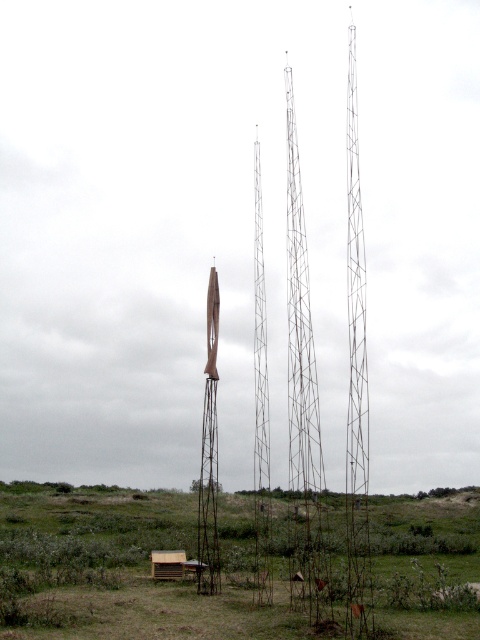
You are a photographer planning to take a photo of the metallic grid tower at center and the shiny metallic rocket at center. Since you want both objects to be clearly visible in your photo, which one should you focus on first to ensure sharpness?

You should focus on the metallic grid tower at center first because it is closer to the viewer than the shiny metallic rocket at center, so focusing on it will ensure both are in focus if they are within the same depth of field.

You are an engineer inspecting the site and need to determine the spatial relationship between the metallic grid tower at center and the shiny metallic rocket at center. Which object is located to the left of the other?

The metallic grid tower at center is positioned on the right side of shiny metallic rocket at center, so the shiny metallic rocket at center is to the left of the metallic grid tower at center.

You are a drone operator tasked with positioning a drone between the three metallic grid towers in the scene. The coordinates for the central tower are given as metallic grid tower at center. Can you determine if the central tower is positioned to the left or right of the center point of the scene?

The metallic grid tower at center is located at point (300,326), which is slightly to the right of the center point of the scene. Therefore, the central tower is positioned to the right of the center point.